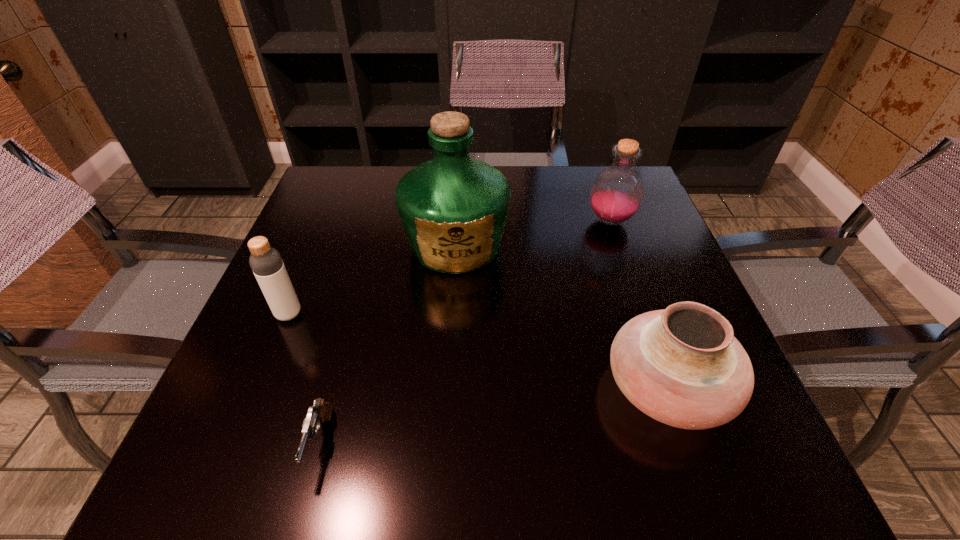
Image resolution: width=960 pixels, height=540 pixels. Find the location of `empty space between the shortest object and the third farthest object`. empty space between the shortest object and the third farthest object is located at coordinates (304, 378).

What are the coordinates of `vacant region between the pottery and the shortest object` in the screenshot? It's located at (494, 414).

This screenshot has width=960, height=540. Find the location of `vacant area between the shortest object and the leftmost object`. vacant area between the shortest object and the leftmost object is located at coordinates (304, 378).

Locate an element on the screen. This screenshot has height=540, width=960. unoccupied area between the third nearest object and the pottery is located at coordinates (478, 350).

You are a GUI agent. You are given a task and a screenshot of the screen. Output one action in this format:
    pyautogui.click(x=<x>, y=<y>)
    Task: Click on the vacant region between the liquor and the pistol
    Image resolution: width=960 pixels, height=540 pixels.
    Given the screenshot: What is the action you would take?
    pyautogui.click(x=388, y=343)

You are a GUI agent. You are given a task and a screenshot of the screen. Output one action in this format:
    pyautogui.click(x=<x>, y=<y>)
    Task: Click on the blank region between the pistol and the pottery
    
    Given the screenshot: What is the action you would take?
    pyautogui.click(x=494, y=414)

Identify the location of vacant area that lies between the farther bottle and the pottery. (638, 304).

Locate an element on the screen. vacant space that's between the pottery and the pistol is located at coordinates (494, 414).

At what (x,y) coordinates should I click in order to perform the action: click on object that is the second closest to the pistol. Please return your answer as a coordinate pair (x, y). Looking at the image, I should click on (453, 208).

Locate an element on the screen. This screenshot has width=960, height=540. the third closest object to the nearer bottle is located at coordinates (682, 366).